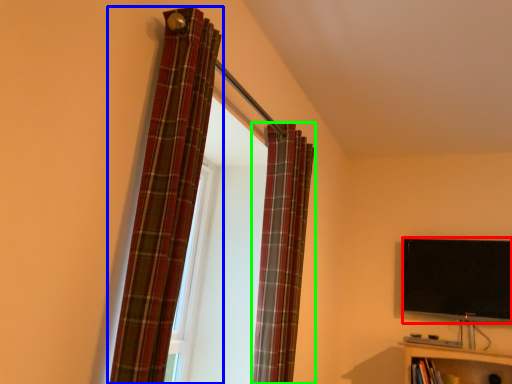
Question: Which object is the closest to the television (highlighted by a red box)? Choose among these: curtain (highlighted by a blue box) or curtain (highlighted by a green box).

Choices:
 (A) curtain
 (B) curtain

Answer: (B)